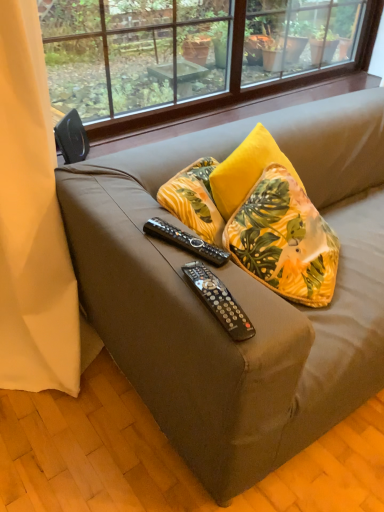
Locate an element on the screen. Image resolution: width=384 pixels, height=512 pixels. empty space that is in between black plastic remote at center, the 1th remote control in the front-to-back sequence, and black plastic remote control at center, which is the first remote control in top-to-bottom order is located at coordinates (202, 270).